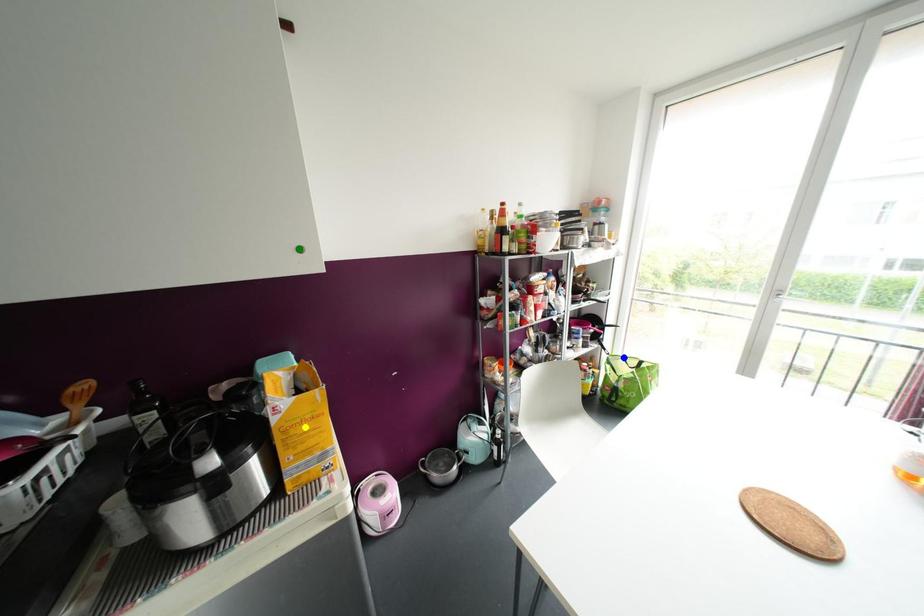
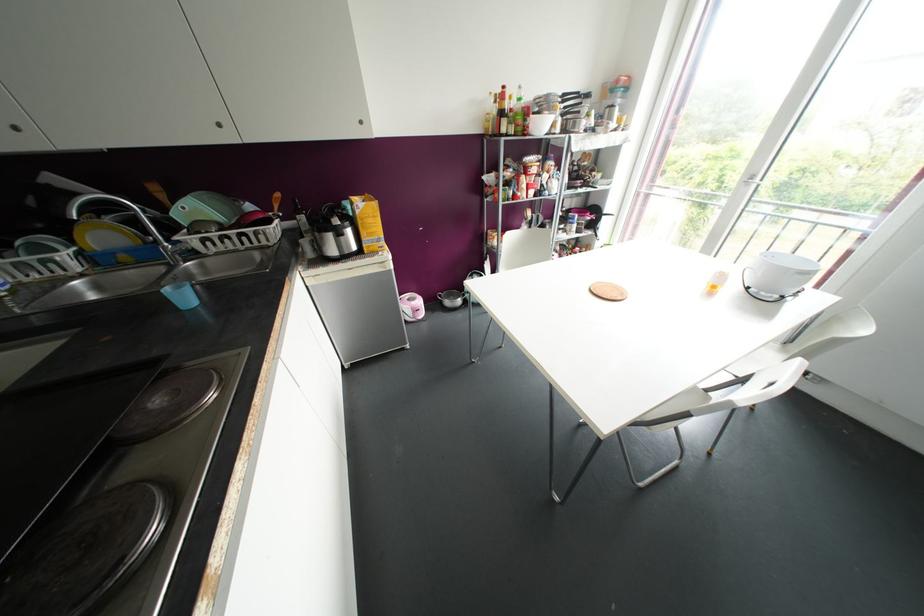
I am providing you with two images of the same scene from different viewpoints. Three points are marked in image1. Which point corresponds to a part or object that is occluded in image2?In image1, three points are marked. Which of them correspond to a part or object that is occluded in image2?Among the three points shown in image1, which one corresponds to a part or object that is no longer visible due to occlusion in image2?

Invisible in image2: blue point.